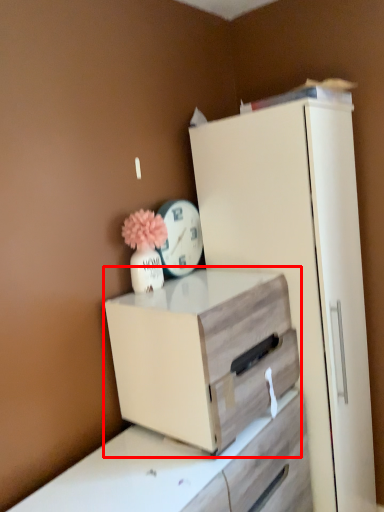
Question: From the image's perspective, what is the correct spatial relationship of chest of drawers (annotated by the red box) in relation to clock?

Choices:
 (A) above
 (B) below

Answer: (B)